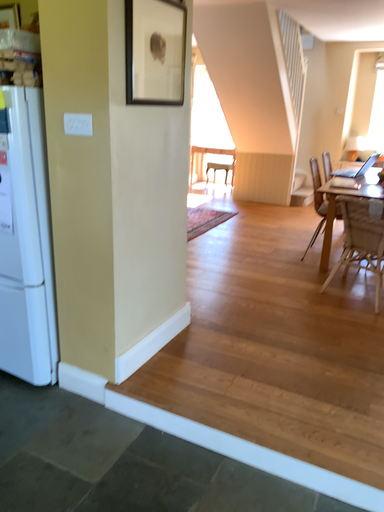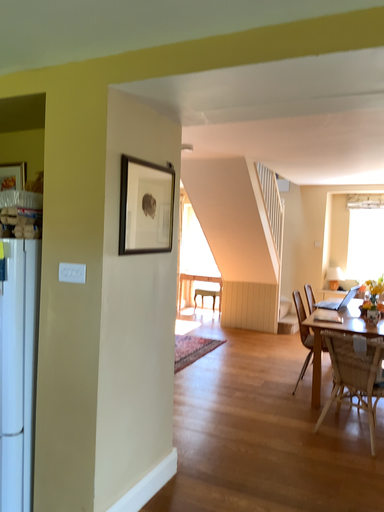
Question: How did the camera likely rotate when shooting the video?

Choices:
 (A) rotated downward
 (B) rotated upward

Answer: (B)